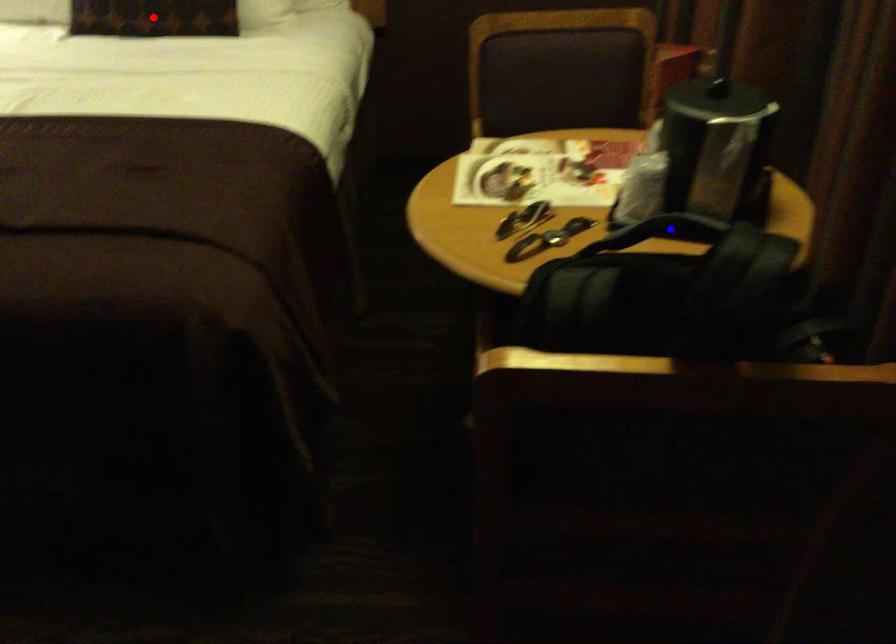
Question: Two points are marked on the image. Which point is closer to the camera?

Choices:
 (A) Blue point is closer.
 (B) Red point is closer.

Answer: (A)